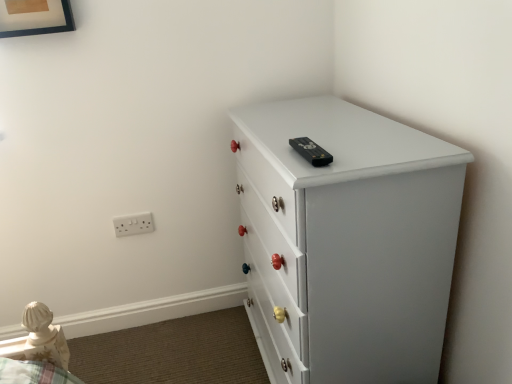
Question: From a real-world perspective, relative to wooden picture frame at upper left, is white painted wood chest of drawers at upper right vertically above or below?

Choices:
 (A) above
 (B) below

Answer: (B)

Question: Considering the positions of white painted wood chest of drawers at upper right and wooden picture frame at upper left in the image, is white painted wood chest of drawers at upper right taller or shorter than wooden picture frame at upper left?

Choices:
 (A) short
 (B) tall

Answer: (B)

Question: Which object is the closest to the white plastic electric outlet at lower left?

Choices:
 (A) wooden picture frame at upper left
 (B) white painted wood chest of drawers at upper right

Answer: (A)

Question: Estimate the real-world distances between objects in this image. Which object is farther from the white plastic electric outlet at lower left?

Choices:
 (A) wooden picture frame at upper left
 (B) white painted wood chest of drawers at upper right

Answer: (B)